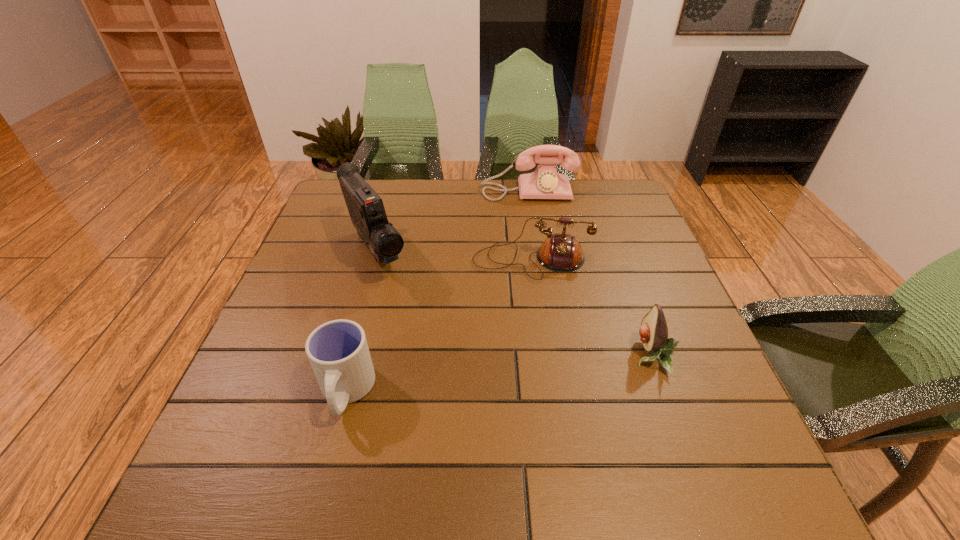
This screenshot has width=960, height=540. In order to click on free space at the far left corner of the desktop in this screenshot , I will do `click(320, 220)`.

The height and width of the screenshot is (540, 960). I want to click on vacant region at the near left corner of the desktop, so click(x=251, y=434).

Find the location of a particular element. The image size is (960, 540). vacant space at the far right corner is located at coordinates (609, 183).

Find the location of `blank space at the near right corner`. blank space at the near right corner is located at coordinates (684, 429).

Locate an element on the screen. The height and width of the screenshot is (540, 960). unoccupied area between the rightmost object and the fourth shortest object is located at coordinates (589, 273).

This screenshot has width=960, height=540. In order to click on free spot between the tallest object and the avocado in this screenshot , I will do `click(514, 303)`.

Locate an element on the screen. free space that is in between the cup and the tallest object is located at coordinates (361, 322).

Find the location of a particular element. blank region between the camcorder and the taller telephone is located at coordinates 452,221.

Image resolution: width=960 pixels, height=540 pixels. Find the location of `free spot between the camcorder and the rightmost object`. free spot between the camcorder and the rightmost object is located at coordinates (514, 303).

Find the location of a particular element. unoccupied area between the cup and the tallest object is located at coordinates (361, 322).